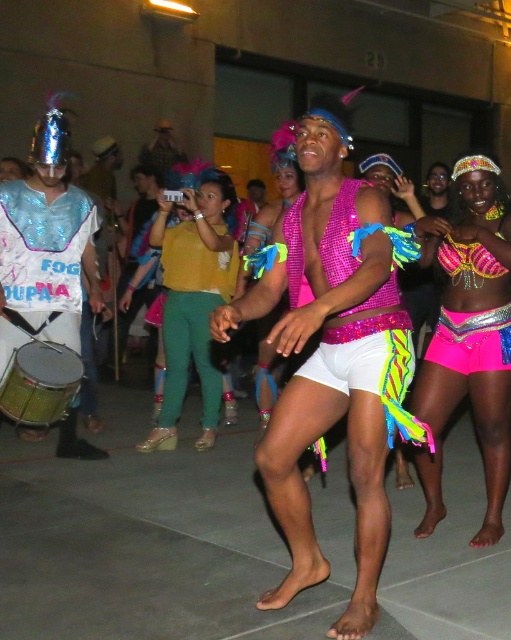
You are organizing a costume party and want to place a gold metallic drum at lower left next to the pink sequined top at center. Based on their sizes, which one should be placed first to ensure they fit on the table?

The gold metallic drum at lower left should be placed first because the pink sequined top at center might be wider and could require more space to accommodate its width.

You are a photographer at the event and want to capture a photo that highlights both the neon pink sequined shorts at center and the pink sequined top at center. Since the camera can only focus on one object at a time, which one should you focus on to ensure the other is still visible in the frame?

The neon pink sequined shorts at center is below the pink sequined top at center, so focusing on the pink sequined top at center would allow the neon pink sequined shorts at center to be visible below it in the frame.

You are at a carnival party and see two items of clothing worn by a dancer. The neon pink sequined shorts at center and the glittery sequined vest at left. Which clothing item is positioned more to the left side of the scene?

The glittery sequined vest at left is positioned more to the left side of the scene compared to the neon pink sequined shorts at center.